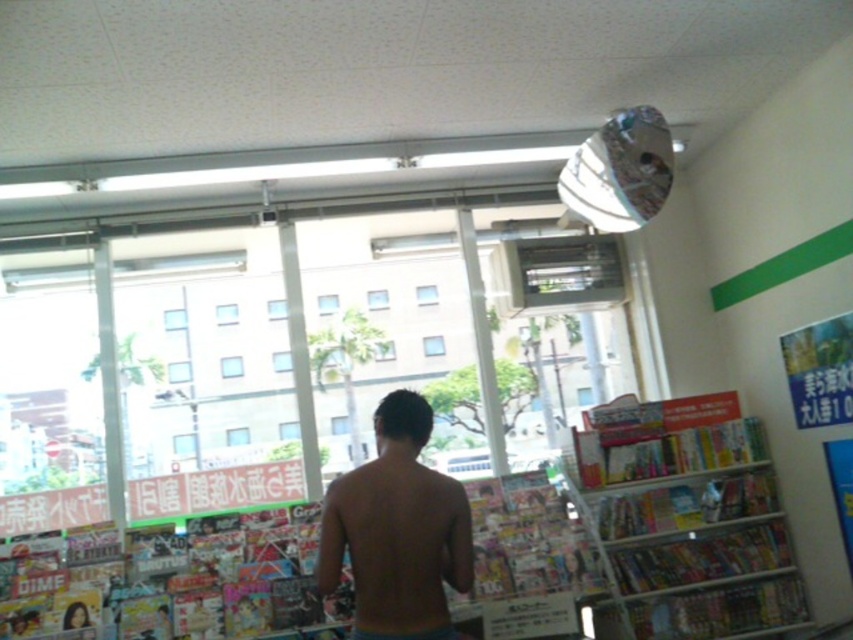
Question: Which point appears closest to the camera in this image?

Choices:
 (A) (726, 602)
 (B) (402, 513)

Answer: (B)

Question: Which point is closer to the camera?

Choices:
 (A) nude skin at center
 (B) multicolored paperbacks at right

Answer: (A)

Question: Can you confirm if multicolored paperbacks at right is bigger than nude skin at center?

Choices:
 (A) no
 (B) yes

Answer: (B)

Question: Is multicolored paperbacks at right closer to camera compared to nude skin at center?

Choices:
 (A) no
 (B) yes

Answer: (A)

Question: Can you confirm if multicolored paperbacks at right is bigger than nude skin at center?

Choices:
 (A) no
 (B) yes

Answer: (B)